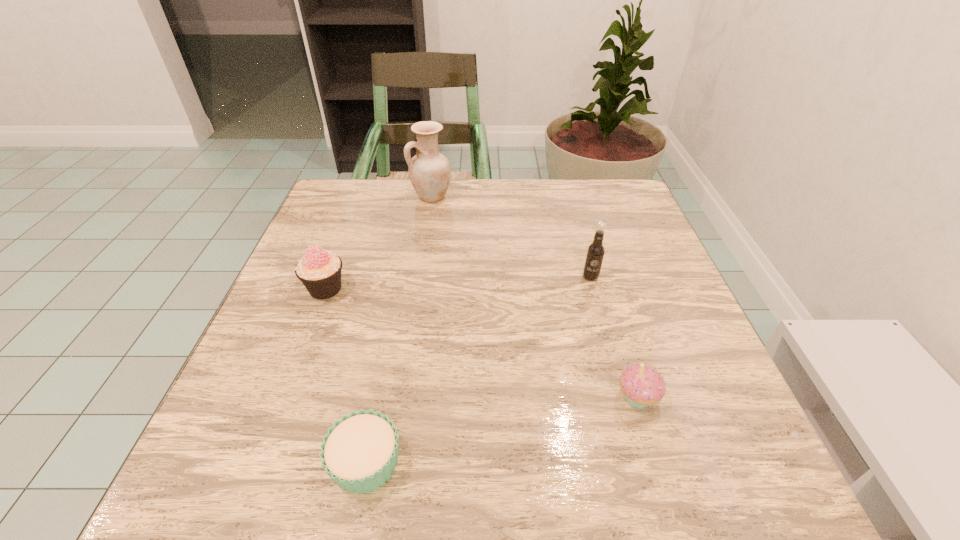
Locate an element on the screen. This screenshot has height=540, width=960. free space at the near edge of the desktop is located at coordinates (480, 481).

Where is `vacant space at the left edge of the desktop`? vacant space at the left edge of the desktop is located at coordinates (231, 399).

This screenshot has height=540, width=960. Find the location of `vacant region at the right edge of the desktop`. vacant region at the right edge of the desktop is located at coordinates (x=649, y=344).

Locate an element on the screen. This screenshot has width=960, height=540. vacant region at the far left corner of the desktop is located at coordinates (364, 190).

What are the coordinates of `free space between the shortest cupcake and the fourth shortest object` in the screenshot? It's located at (478, 369).

At what (x,y) coordinates should I click in order to perform the action: click on vacant space in between the fourth farthest object and the shortest object. Please return your answer as a coordinate pair (x, y). Looking at the image, I should click on (501, 430).

This screenshot has width=960, height=540. Identify the location of empty space that is in between the second tallest object and the leftmost cupcake. (458, 282).

Find the location of a particular element. This screenshot has width=960, height=540. unoccupied position between the second cupcake from right to left and the farthest cupcake is located at coordinates (346, 375).

This screenshot has height=540, width=960. Identify the location of unoccupied area between the nearest cupcake and the second nearest object. (501, 430).

Identify the location of free space between the rightmost cupcake and the second cupcake from right to left. This screenshot has width=960, height=540. (501, 430).